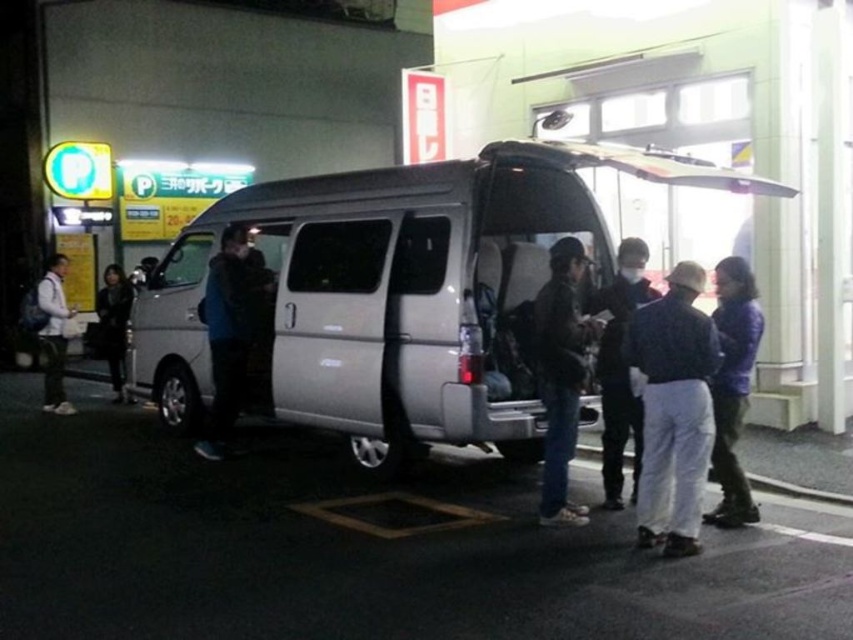
Question: Is purple quilted jacket at lower right further to camera compared to dark blue jacket at center?

Choices:
 (A) no
 (B) yes

Answer: (A)

Question: Is purple quilted jacket at lower right below leather jacket at left?

Choices:
 (A) no
 (B) yes

Answer: (B)

Question: Which point is farther from the camera taking this photo?

Choices:
 (A) (169, 332)
 (B) (711, 381)
 (C) (235, 273)

Answer: (A)

Question: Is silver metallic van at center thinner than dark blue jacket at left?

Choices:
 (A) yes
 (B) no

Answer: (B)

Question: Which point is farther from the camera taking this photo?

Choices:
 (A) (51, 317)
 (B) (668, 298)

Answer: (A)

Question: Which point appears closest to the camera in this image?

Choices:
 (A) (697, 433)
 (B) (393, 243)
 (C) (738, 337)

Answer: (A)